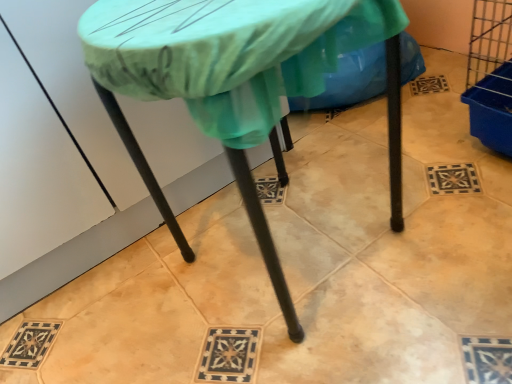
Locate an element on the screen. The width and height of the screenshot is (512, 384). vacant space in matte green tablecloth at center (from a real-world perspective) is located at coordinates pyautogui.click(x=305, y=248).